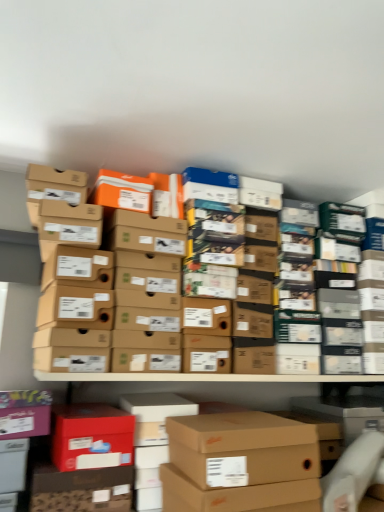
At what (x,y) coordinates should I click in order to perform the action: click on matte cardboard box at center. Please return your answer as a coordinate pair (x, y). The height and width of the screenshot is (512, 384). Looking at the image, I should click on (34, 466).

Describe the element at coordinates (34, 466) in the screenshot. The width and height of the screenshot is (384, 512). I see `matte cardboard box at center` at that location.

Where is `matte cardboard box at center`? matte cardboard box at center is located at coordinates (34, 466).